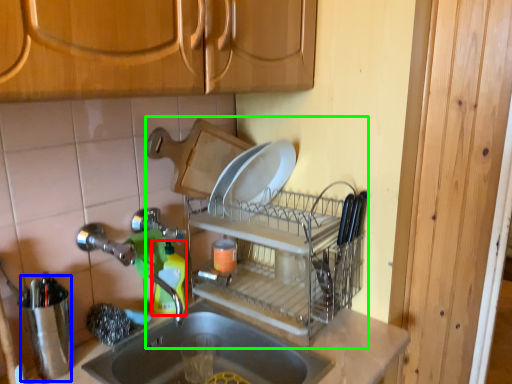
Question: Which object is the farthest from bottle (highlighted by a red box)? Choose among these: appliance (highlighted by a blue box) or dish washer (highlighted by a green box).

Choices:
 (A) appliance
 (B) dish washer

Answer: (A)